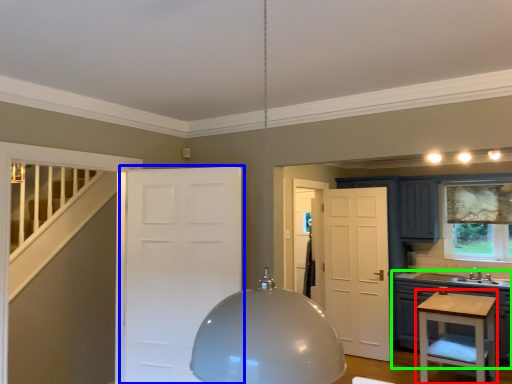
Question: Which object is the farthest from vanity (highlighted by a red box)? Choose among these: door (highlighted by a blue box) or cabinetry (highlighted by a green box).

Choices:
 (A) door
 (B) cabinetry

Answer: (A)